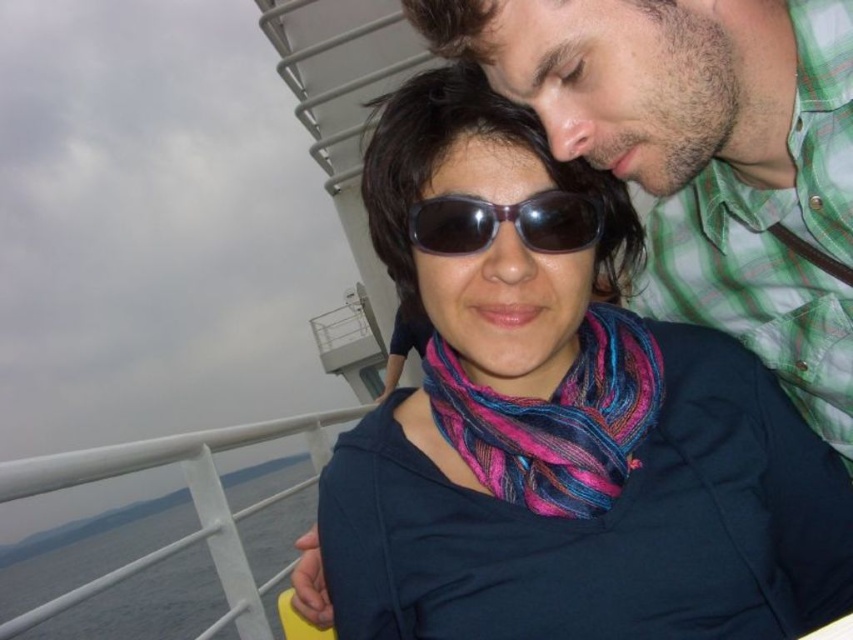
Who is shorter, multicolored woven scarf at center or sunglasses at center?

sunglasses at center is shorter.

Which of these two, multicolored woven scarf at center or sunglasses at center, stands taller?

Standing taller between the two is multicolored woven scarf at center.

This screenshot has width=853, height=640. In order to click on multicolored woven scarf at center in this screenshot , I will do `click(555, 419)`.

The height and width of the screenshot is (640, 853). What do you see at coordinates (563, 429) in the screenshot? I see `matte black sunglasses at center` at bounding box center [563, 429].

How far apart are matte black sunglasses at center and multicolored woven scarf at center?

They are 6.74 inches apart.

Who is more forward, (711, 500) or (515, 404)?

Point (711, 500) is in front.

Locate an element on the screen. matte black sunglasses at center is located at coordinates (563, 429).

Is matte black sunglasses at center wider than sunglasses at center?

Correct, the width of matte black sunglasses at center exceeds that of sunglasses at center.

Which is more to the left, matte black sunglasses at center or sunglasses at center?

sunglasses at center

The image size is (853, 640). Describe the element at coordinates (563, 429) in the screenshot. I see `matte black sunglasses at center` at that location.

In order to click on matte black sunglasses at center in this screenshot , I will do `click(563, 429)`.